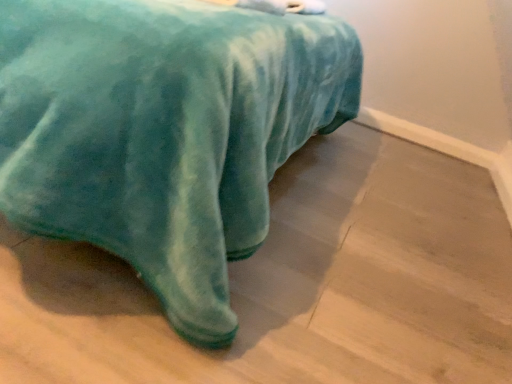
In order to face velvety teal blanket at center, should I rotate leftwards or rightwards?

To align with it, rotate left about 21.511°.

Describe the element at coordinates (164, 132) in the screenshot. This screenshot has width=512, height=384. I see `velvety teal blanket at center` at that location.

Image resolution: width=512 pixels, height=384 pixels. I want to click on velvety teal blanket at center, so click(x=164, y=132).

Identify the location of velvety teal blanket at center. (164, 132).